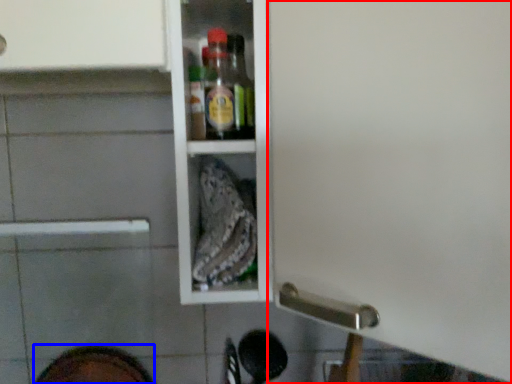
Question: Among these objects, which one is nearest to the camera, screen door (highlighted by a red box) or footwear (highlighted by a blue box)?

Choices:
 (A) screen door
 (B) footwear

Answer: (A)